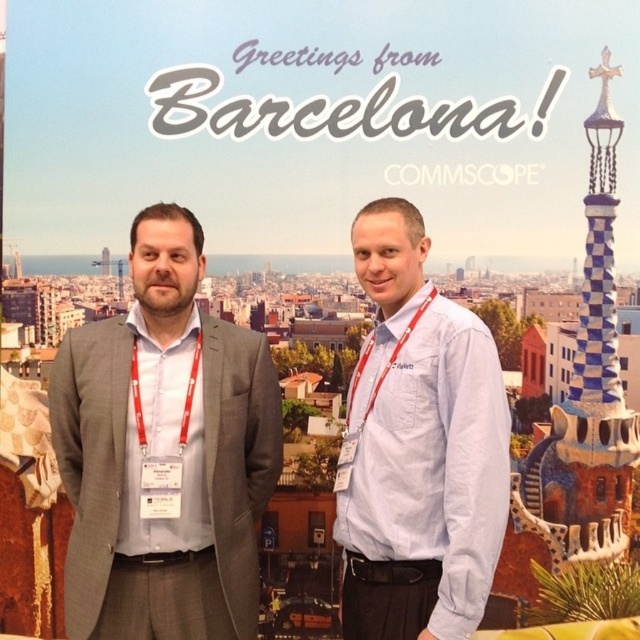
Question: Can you confirm if gray suit at left is smaller than light blue shirt at center?

Choices:
 (A) yes
 (B) no

Answer: (A)

Question: Which point is farther to the camera?

Choices:
 (A) gray suit at left
 (B) light blue shirt at center

Answer: (A)

Question: Can you confirm if gray suit at left is wider than light blue shirt at center?

Choices:
 (A) no
 (B) yes

Answer: (B)

Question: Observing the image, what is the correct spatial positioning of gray suit at left in reference to light blue shirt at center?

Choices:
 (A) above
 (B) below

Answer: (B)

Question: Among these points, which one is farthest from the camera?

Choices:
 (A) (353, 426)
 (B) (170, 252)

Answer: (A)